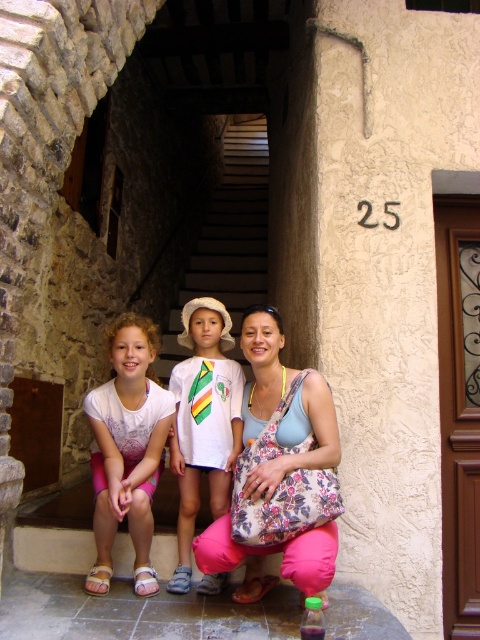
Question: Which point is farther to the camera?

Choices:
 (A) white cotton shirt at lower left
 (B) white cotton shirt at center
 (C) floral fabric bag at center

Answer: (B)

Question: Can you confirm if white cotton shirt at lower left is positioned below white cotton shirt at center?

Choices:
 (A) no
 (B) yes

Answer: (A)

Question: Which of these objects is positioned farthest from the white cotton shirt at lower left?

Choices:
 (A) white cotton shirt at center
 (B) white stone stairs at center

Answer: (B)

Question: Among these points, which one is nearest to the camera?

Choices:
 (A) (189, 474)
 (B) (284, 420)
 (C) (208, 275)

Answer: (B)

Question: Does floral fabric bag at center have a lesser width compared to white cotton shirt at lower left?

Choices:
 (A) no
 (B) yes

Answer: (A)

Question: Can you confirm if white cotton shirt at center is wider than white stone stairs at center?

Choices:
 (A) no
 (B) yes

Answer: (A)